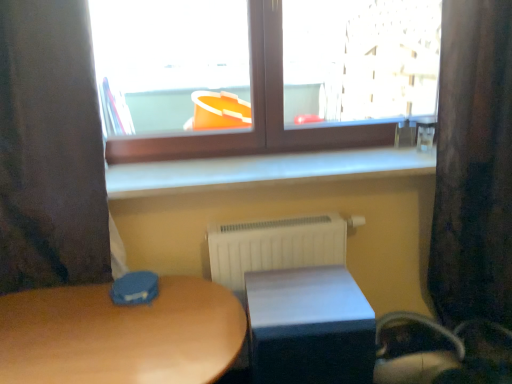
Find the location of a particular element. This screenshot has width=512, height=384. empty space that is ontop of white smooth window sill at center (from a real-world perspective) is located at coordinates (270, 161).